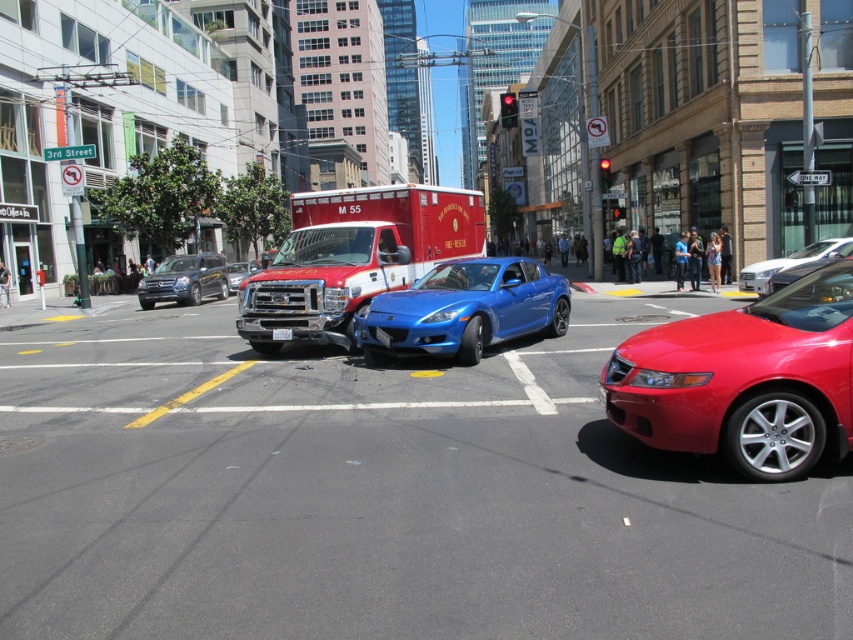
Which of these two, glossy red car at lower right or metallic silver sedan at center, stands taller?

With more height is metallic silver sedan at center.

Is glossy red car at lower right wider than metallic silver sedan at center?

Incorrect, glossy red car at lower right's width does not surpass metallic silver sedan at center's.

At what (x,y) coordinates should I click in order to perform the action: click on glossy red car at lower right. Please return your answer as a coordinate pair (x, y). Looking at the image, I should click on (746, 380).

At what (x,y) coordinates should I click in order to perform the action: click on glossy red car at lower right. Please return your answer as a coordinate pair (x, y). Looking at the image, I should click on (746, 380).

Can you confirm if metallic blue car at center is taller than blue glossy sports car at center?

No, metallic blue car at center is not taller than blue glossy sports car at center.

Does point (556, 449) come behind point (483, 301)?

No.

At what (x,y) coordinates should I click in order to perform the action: click on metallic blue car at center. Please return your answer as a coordinate pair (x, y). The height and width of the screenshot is (640, 853). Looking at the image, I should click on [x=381, y=497].

What do you see at coordinates (381, 497) in the screenshot? Image resolution: width=853 pixels, height=640 pixels. I see `metallic blue car at center` at bounding box center [381, 497].

Who is shorter, metallic blue car at center or white plastic license plate at center?

white plastic license plate at center is shorter.

Between point (379, 428) and point (289, 339), which one is positioned behind?

The point (289, 339) is more distant.

Locate an element on the screen. metallic blue car at center is located at coordinates (381, 497).